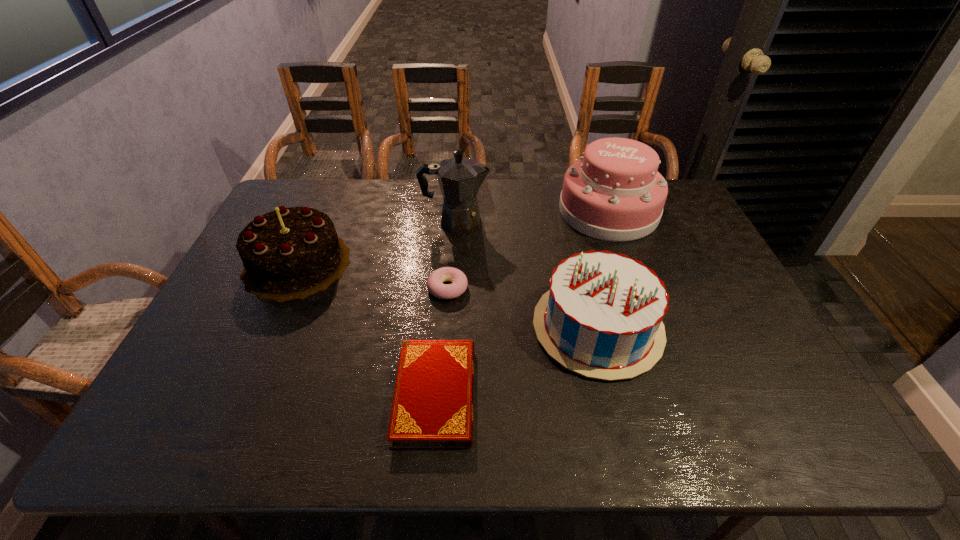
The width and height of the screenshot is (960, 540). I want to click on object situated at the left edge, so click(290, 253).

Identify the location of object at the right edge. The width and height of the screenshot is (960, 540). (614, 192).

Locate an element on the screen. object at the far right corner is located at coordinates (614, 192).

Find the location of a particular element. This screenshot has height=540, width=960. blank area at the far edge is located at coordinates (433, 212).

The image size is (960, 540). In the image, there is a desktop. Identify the location of vacant region at the near edge. (727, 438).

This screenshot has height=540, width=960. I want to click on free space at the right edge of the desktop, so click(753, 389).

The width and height of the screenshot is (960, 540). Identify the location of vacant area that lies between the coffeepot and the leftmost birthday cake. (376, 242).

This screenshot has width=960, height=540. What are the coordinates of `vacant space in between the hardback book and the coffeepot` in the screenshot? It's located at (445, 308).

Point out which object is positioned as the fourth nearest to the doughnut. Please provide its 2D coordinates. Your answer should be formatted as a tuple, i.e. [(x, y)], where the tuple contains the x and y coordinates of a point satisfying the conditions above.

[(290, 253)]

Locate which object ranks in proximity to the leftmost object. Please provide its 2D coordinates. Your answer should be formatted as a tuple, i.e. [(x, y)], where the tuple contains the x and y coordinates of a point satisfying the conditions above.

[(460, 178)]